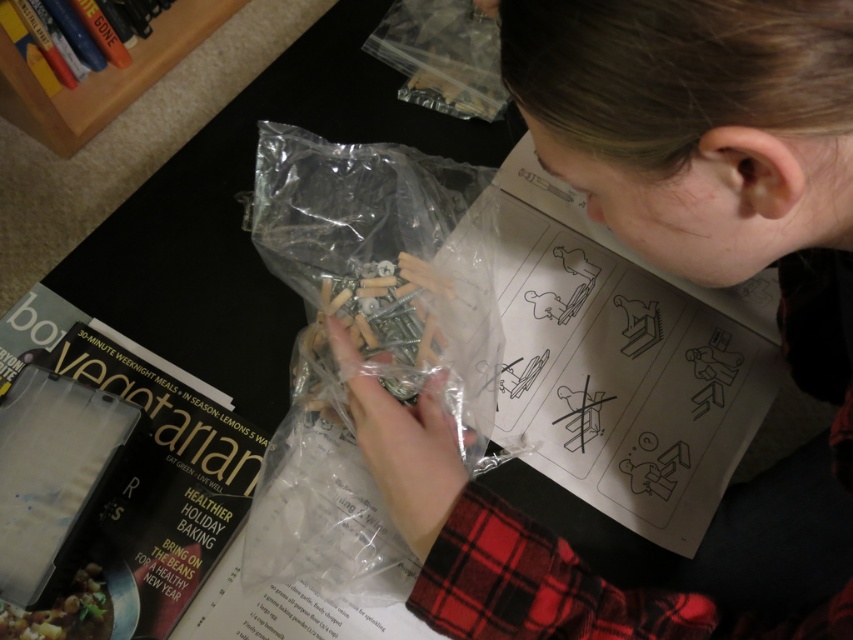
You are organizing a bookshelf and have a wooden bookshelf at upper left and a hardcover book at upper left. Which item is taller?

The wooden bookshelf at upper left is taller than the hardcover book at upper left.

You are helping someone assemble furniture and notice two items in the image. The first is a matte plastic bag of screws at center, and the second is a hardcover book at upper left. Which item is positioned to the right of the other?

The matte plastic bag of screws at center is to the right of the hardcover book at upper left.